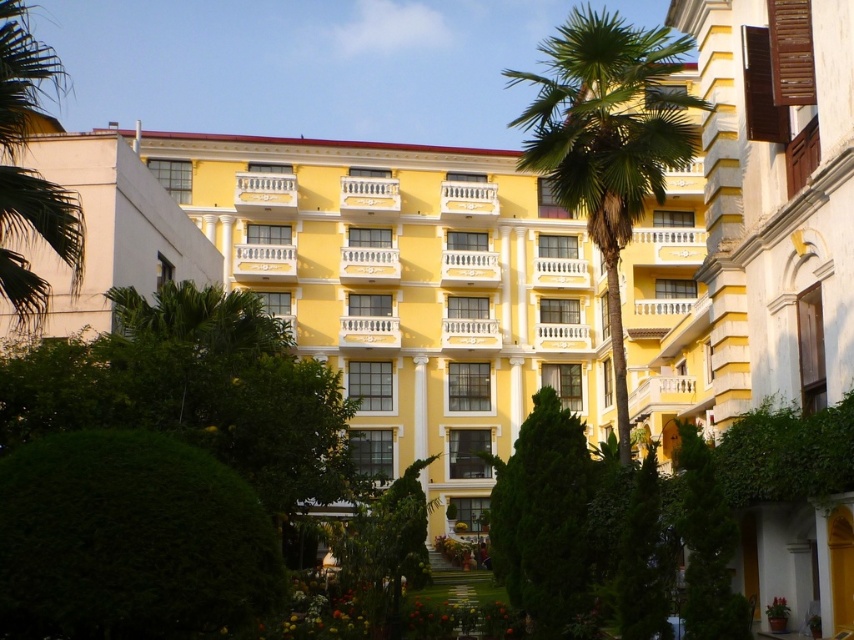
Question: Is green textured tree at center below green leafy tree at lower right?

Choices:
 (A) no
 (B) yes

Answer: (B)

Question: Which of these objects is positioned closest to the yellow matte building at upper right?

Choices:
 (A) green textured tree at center
 (B) yellow painted building at center
 (C) green leafy tree at lower right
 (D) green leafy palm tree at center

Answer: (C)

Question: Which object is closer to the camera taking this photo?

Choices:
 (A) green leafy palm tree at center
 (B) green leafy tree at lower right
 (C) yellow matte building at upper right

Answer: (B)

Question: Is yellow painted building at center below green leafy palm tree at center?

Choices:
 (A) yes
 (B) no

Answer: (A)

Question: Which object is the closest to the green leafy palm tree at center?

Choices:
 (A) yellow painted building at center
 (B) yellow matte building at upper right
 (C) green textured tree at center
 (D) green leafy tree at lower right

Answer: (B)

Question: Is yellow painted building at center positioned before yellow matte building at upper right?

Choices:
 (A) yes
 (B) no

Answer: (B)